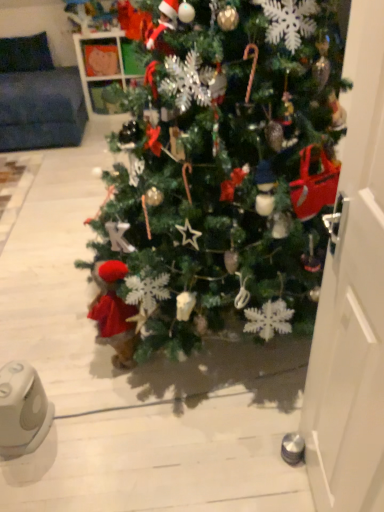
The image size is (384, 512). What are the coordinates of `green matte christmas tree at center` in the screenshot? It's located at (226, 165).

From the image's perspective, which one is positioned higher, white glossy door at right or green matte christmas tree at center?

green matte christmas tree at center is shown above in the image.

Is white glossy door at right facing towards green matte christmas tree at center?

No, white glossy door at right is not aimed at green matte christmas tree at center.

From a real-world perspective, is white glossy door at right below green matte christmas tree at center?

No.

This screenshot has width=384, height=512. Identify the location of door above the white plastic ipod at lower left (from the image's perspective). (352, 297).

In the image, is white plastic ipod at lower left positioned in front of or behind white glossy door at right?

white plastic ipod at lower left is positioned farther from the viewer than white glossy door at right.

From a real-world perspective, does white plastic ipod at lower left sit lower than white glossy door at right?

Yes, from a real-world perspective, white plastic ipod at lower left is beneath white glossy door at right.

Choose the correct answer: Is white plastic ipod at lower left inside white glossy door at right or outside it?

white plastic ipod at lower left is spatially situated outside white glossy door at right.

From the image's perspective, which is below, white plastic ipod at lower left or green matte christmas tree at center?

white plastic ipod at lower left.

Is white plastic ipod at lower left facing towards green matte christmas tree at center?

Yes, white plastic ipod at lower left is turned towards green matte christmas tree at center.

Would you say white plastic ipod at lower left is inside or outside green matte christmas tree at center?

white plastic ipod at lower left is located beyond the bounds of green matte christmas tree at center.

Which object is positioned more to the left, white plastic ipod at lower left or green matte christmas tree at center?

From the viewer's perspective, white plastic ipod at lower left appears more on the left side.

Which is closer to the camera, [223,198] or [30,379]?

Point [223,198] is closer to the camera than point [30,379].

Is green matte christmas tree at center to the left or to the right of white plastic ipod at lower left in the image?

Clearly, green matte christmas tree at center is on the right of white plastic ipod at lower left in the image.

Can you tell me how much green matte christmas tree at center and white plastic ipod at lower left differ in facing direction?

The angle between the facing direction of green matte christmas tree at center and the facing direction of white plastic ipod at lower left is 101 degrees.

From a real-world perspective, between green matte christmas tree at center and white plastic ipod at lower left, who is vertically lower?

From a 3D spatial view, white plastic ipod at lower left is below.

Is green matte christmas tree at center not close to white glossy door at right?

green matte christmas tree at center is actually quite close to white glossy door at right.

Is green matte christmas tree at center oriented towards white glossy door at right?

No, green matte christmas tree at center is not turned towards white glossy door at right.

Between green matte christmas tree at center and white glossy door at right, which one has smaller size?

white glossy door at right is smaller.

Is white glossy door at right at the right side of white plastic ipod at lower left?

Indeed, white glossy door at right is positioned on the right side of white plastic ipod at lower left.

Between white glossy door at right and white plastic ipod at lower left, which one has smaller size?

With smaller size is white plastic ipod at lower left.

How many degrees apart are the facing directions of white glossy door at right and white plastic ipod at lower left?

The angular difference between white glossy door at right and white plastic ipod at lower left is 96.6 degrees.

Is the position of white glossy door at right more distant than that of white plastic ipod at lower left?

No, it is in front of white plastic ipod at lower left.

Identify the location of door that is below the green matte christmas tree at center (from the image's perspective). (352, 297).

Image resolution: width=384 pixels, height=512 pixels. Find the location of `ipod that appears on the left of white glossy door at right`. ipod that appears on the left of white glossy door at right is located at coordinates (22, 409).

Based on their spatial positions, is white glossy door at right or white plastic ipod at lower left further from green matte christmas tree at center?

Among the two, white plastic ipod at lower left is located further to green matte christmas tree at center.

From the image, which object appears to be nearer to white plastic ipod at lower left, white glossy door at right or green matte christmas tree at center?

green matte christmas tree at center lies closer to white plastic ipod at lower left than the other object.

Based on their spatial positions, is green matte christmas tree at center or white plastic ipod at lower left closer to white glossy door at right?

Based on the image, green matte christmas tree at center appears to be nearer to white glossy door at right.

Looking at the image, which one is located closer to green matte christmas tree at center, white plastic ipod at lower left or white glossy door at right?

white glossy door at right is closer to green matte christmas tree at center.

Based on the photo, when comparing their distances from white glossy door at right, does white plastic ipod at lower left or green matte christmas tree at center seem closer?

The object closer to white glossy door at right is green matte christmas tree at center.

Looking at the image, which one is located closer to white plastic ipod at lower left, green matte christmas tree at center or white glossy door at right?

green matte christmas tree at center is closer to white plastic ipod at lower left.

The width and height of the screenshot is (384, 512). I want to click on christmas tree positioned between white glossy door at right and white plastic ipod at lower left from near to far, so click(x=226, y=165).